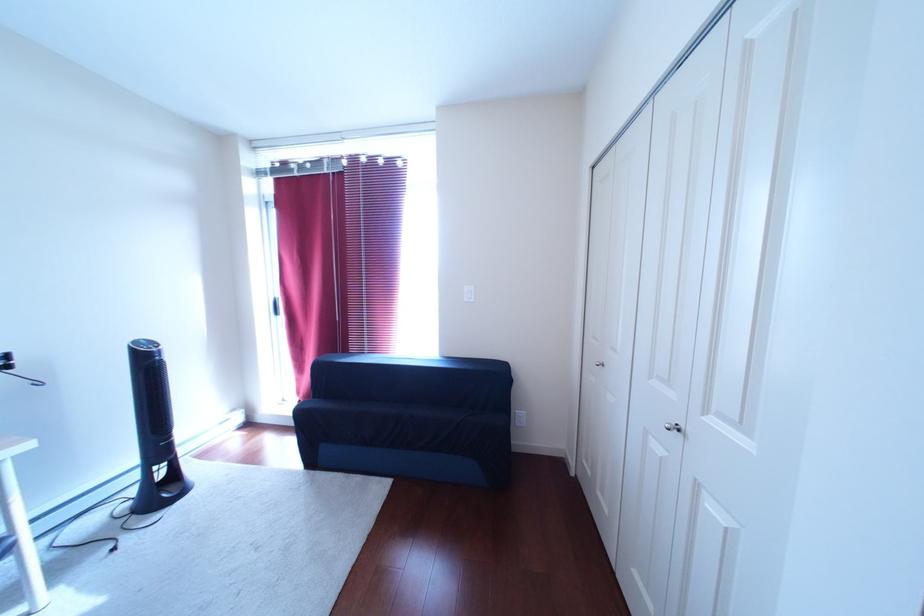
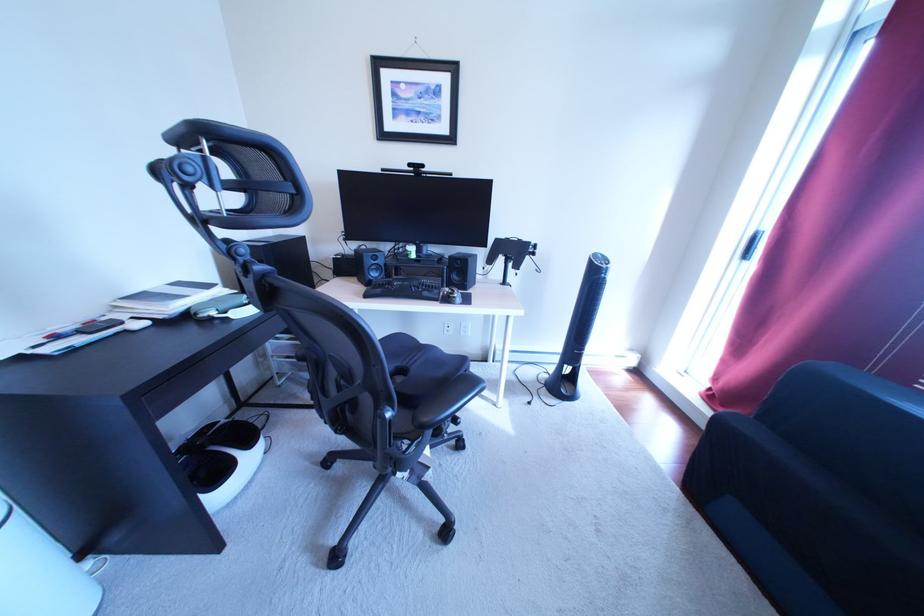
First-person continuous shooting, in which direction is the camera rotating?

The camera's rotation is toward left-down.